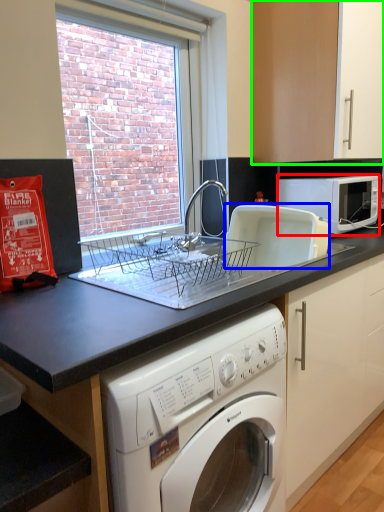
Question: Based on their relative distances, which object is farther from microwave oven (highlighted by a red box)? Choose from appliance (highlighted by a blue box) and cabinetry (highlighted by a green box).

Choices:
 (A) appliance
 (B) cabinetry

Answer: (B)